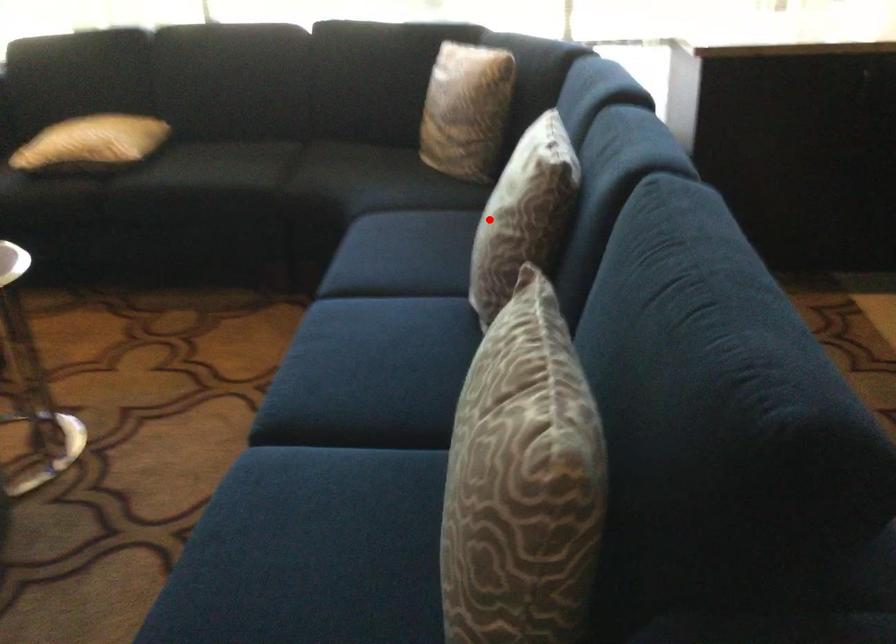
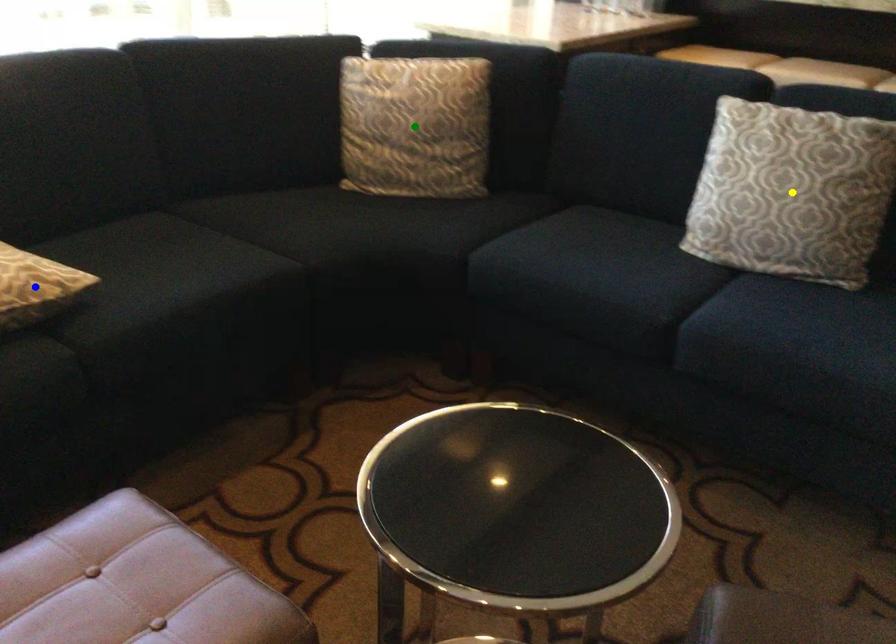
Question: I am providing you with two images of the same scene from different viewpoints. A red point is marked on the first image. You are given multiple points on the second image. Which mark in image 2 goes with the point in image 1?

Choices:
 (A) green point
 (B) blue point
 (C) yellow point

Answer: (C)